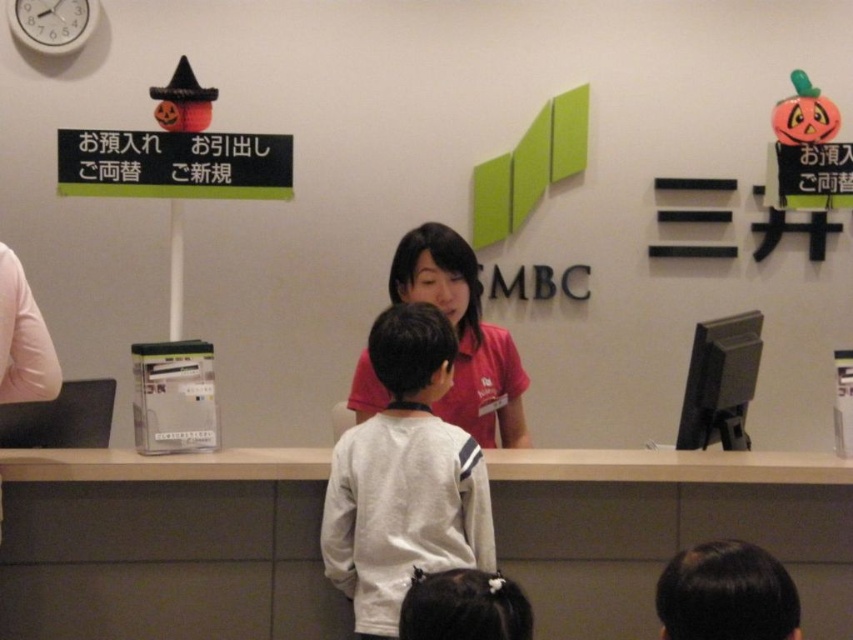
Looking at this image, you are a tailor who needs to determine which garment to alter first. You have a white fleece jacket at center and a red matte shirt at center. Based on their thickness, which one should you handle first if you want to start with the thinner fabric?

The white fleece jacket at center is thinner than the red matte shirt at center, so you should start with the white fleece jacket at center first.

You are standing at the entrance of the MBC bank and need to reach the white matte information desk at center. According to the scene description, where should you head towards?

The white matte information desk at center is located at point (663, 528), so you should head towards that coordinate.

You are a customer at the MBC bank and need to ask about services. You see the white matte information desk at center and the white plastic clock at upper left. Which object is closer to you?

The white matte information desk at center is closer to you because it is in front of the white plastic clock at upper left.